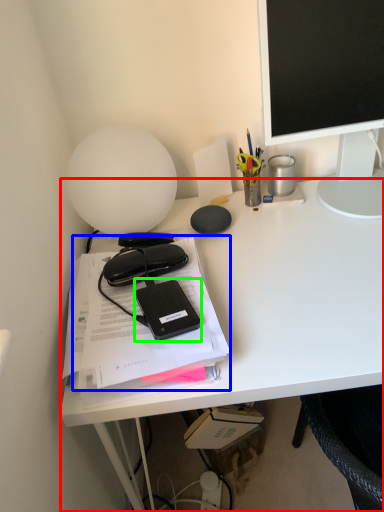
Question: Based on their relative distances, which object is farther from desk (highlighted by a red box)? Choose from document (highlighted by a blue box) and equipment (highlighted by a green box).

Choices:
 (A) document
 (B) equipment

Answer: (B)